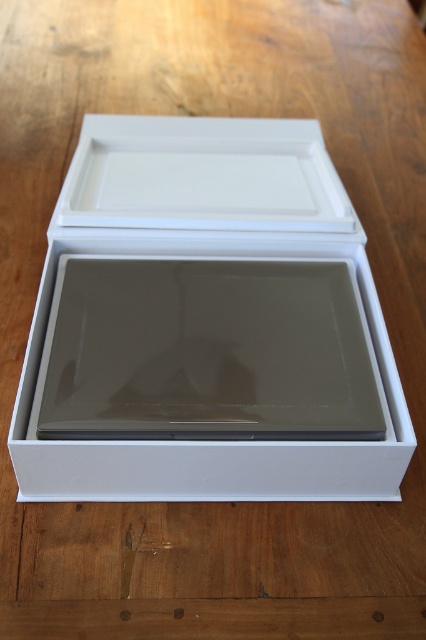
Question: Is white matte box at center to the left of white matte tray at upper center from the viewer's perspective?

Choices:
 (A) no
 (B) yes

Answer: (B)

Question: Considering the relative positions of white matte box at center and white matte tray at upper center in the image provided, where is white matte box at center located with respect to white matte tray at upper center?

Choices:
 (A) below
 (B) above

Answer: (A)

Question: Which object is closer to the camera taking this photo?

Choices:
 (A) white matte box at center
 (B) white matte tray at upper center

Answer: (A)

Question: Which point is farther to the camera?

Choices:
 (A) (207, 221)
 (B) (164, 483)

Answer: (A)

Question: Does white matte box at center have a greater width compared to white matte tray at upper center?

Choices:
 (A) yes
 (B) no

Answer: (A)